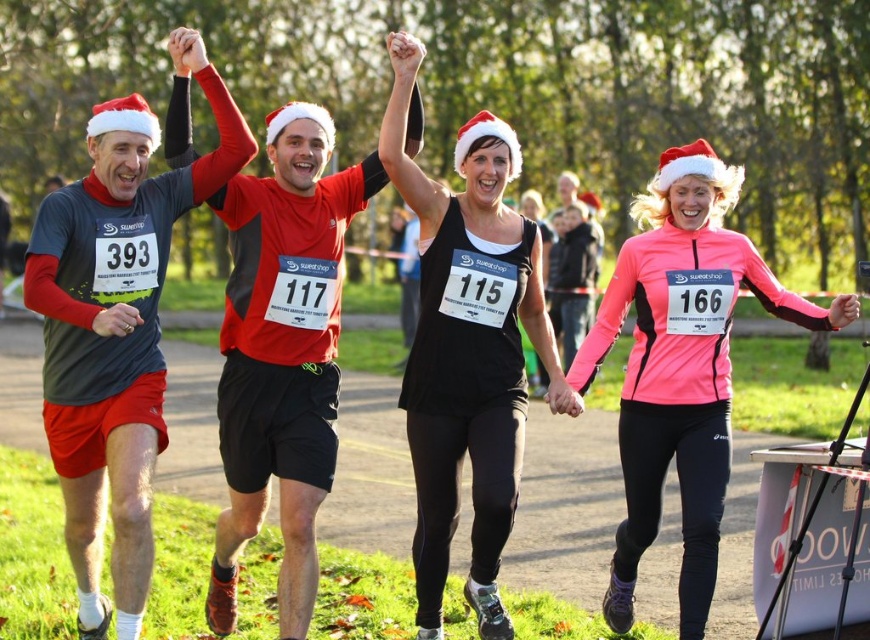
You are a photographer positioned at the origin point of the image. You need to capture a photo of the red matte jersey at center. According to the coordinates provided, in which direction should you move your camera to frame the jersey properly?

The red matte jersey at center is located at coordinates point (282,353). Since the origin point is at the bottom left corner of the image, moving the camera to the right and slightly upwards would position the jersey in the center of the frame.

Based on the photo, you are a photographer at the Christmas race and need to capture a photo of the two runners wearing the red matte jersey at center and the black matte tank top at center. To ensure both are fully visible in the frame, which runner should you position closer to the camera?

The red matte jersey at center is shorter than the black matte tank top at center, so you should position the red matte jersey at center closer to the camera to ensure both are fully visible in the frame.